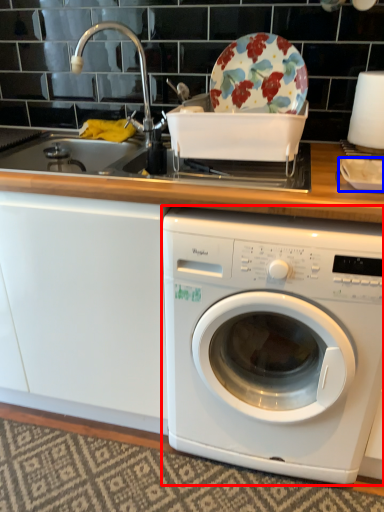
Question: Which of the following is the farthest to the observer, washing machine (highlighted by a red box) or tableware (highlighted by a blue box)?

Choices:
 (A) washing machine
 (B) tableware

Answer: (B)